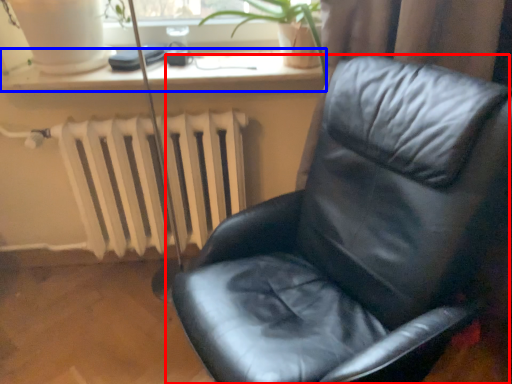
Question: Which object is closer to the camera taking this photo, chair (highlighted by a red box) or window sill (highlighted by a blue box)?

Choices:
 (A) chair
 (B) window sill

Answer: (A)